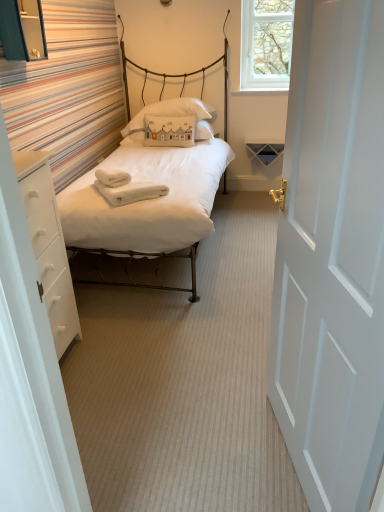
The height and width of the screenshot is (512, 384). I want to click on vacant space that's between white matte drawer at left and white painted wood door at right, so click(x=170, y=415).